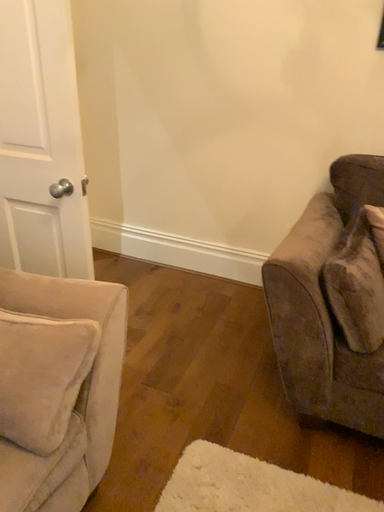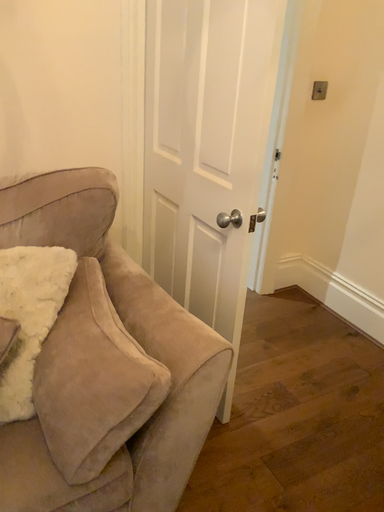
Question: Which way did the camera rotate in the video?

Choices:
 (A) rotated upward
 (B) rotated downward

Answer: (A)